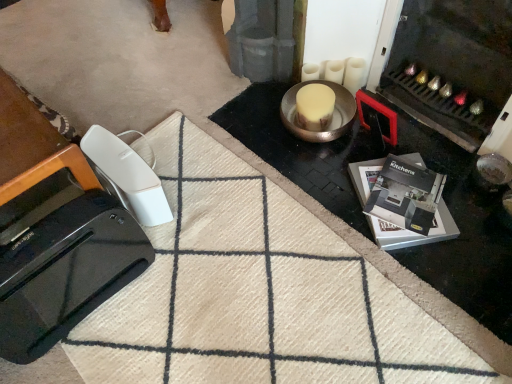
Where is `free spot above white plastic remote at lower left, the 1th home appliance from the back (from a real-world perspective)`? The height and width of the screenshot is (384, 512). free spot above white plastic remote at lower left, the 1th home appliance from the back (from a real-world perspective) is located at coordinates (117, 164).